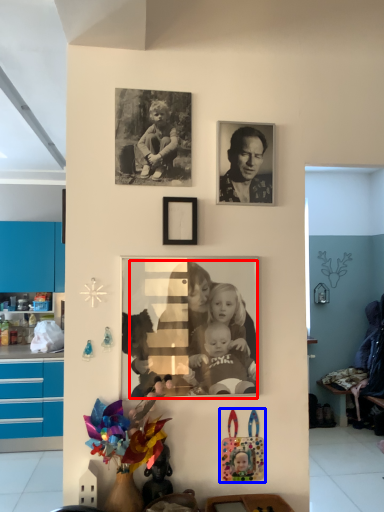
Question: Which object appears farthest to the camera in this image, person (highlighted by a red box) or toy (highlighted by a blue box)?

Choices:
 (A) person
 (B) toy

Answer: (B)